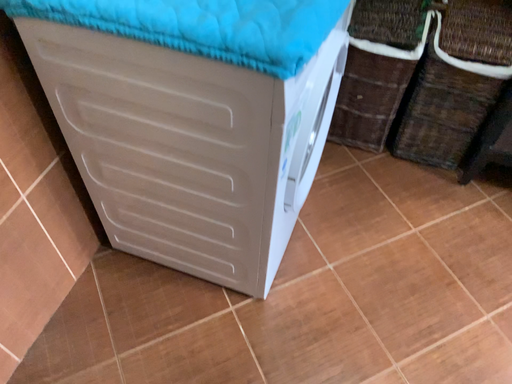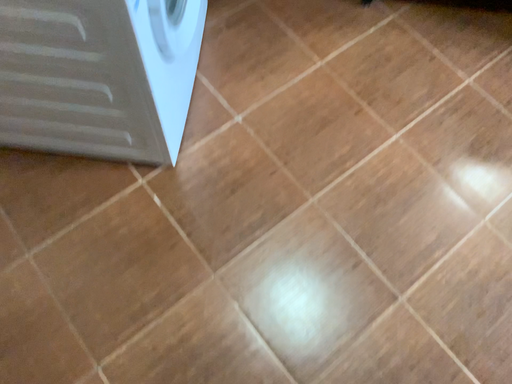
Question: How did the camera likely rotate when shooting the video?

Choices:
 (A) rotated upward
 (B) rotated downward

Answer: (B)